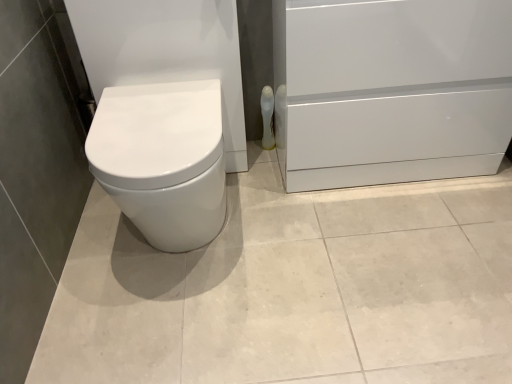
Question: Is white glossy toilet paper at center-right far away from white glossy file cabinet at lower right?

Choices:
 (A) yes
 (B) no

Answer: (B)

Question: Does white glossy toilet paper at center-right appear on the right side of white glossy file cabinet at lower right?

Choices:
 (A) yes
 (B) no

Answer: (B)

Question: From the image's perspective, is white glossy toilet paper at center-right on white glossy file cabinet at lower right?

Choices:
 (A) no
 (B) yes

Answer: (A)

Question: From a real-world perspective, is white glossy toilet paper at center-right located higher than white glossy file cabinet at lower right?

Choices:
 (A) yes
 (B) no

Answer: (B)

Question: Is white glossy toilet paper at center-right smaller than white glossy file cabinet at lower right?

Choices:
 (A) no
 (B) yes

Answer: (B)

Question: Is white glossy toilet paper at center-right thinner than white glossy file cabinet at lower right?

Choices:
 (A) no
 (B) yes

Answer: (B)

Question: Can you confirm if white glossy file cabinet at lower right is smaller than white glossy toilet paper at center-right?

Choices:
 (A) yes
 (B) no

Answer: (B)

Question: Is white glossy toilet paper at center-right at the back of white glossy file cabinet at lower right?

Choices:
 (A) no
 (B) yes

Answer: (A)

Question: Can you confirm if white glossy file cabinet at lower right is positioned to the right of white glossy toilet paper at center-right?

Choices:
 (A) yes
 (B) no

Answer: (A)

Question: Is white glossy file cabinet at lower right oriented towards white glossy toilet paper at center-right?

Choices:
 (A) no
 (B) yes

Answer: (A)

Question: Considering the relative sizes of white glossy file cabinet at lower right and white glossy toilet paper at center-right in the image provided, is white glossy file cabinet at lower right taller than white glossy toilet paper at center-right?

Choices:
 (A) no
 (B) yes

Answer: (B)

Question: From a real-world perspective, is white glossy file cabinet at lower right physically below white glossy toilet paper at center-right?

Choices:
 (A) no
 (B) yes

Answer: (A)

Question: From the image's perspective, is white glossy toilet paper at center-right above or below white glossy file cabinet at lower right?

Choices:
 (A) below
 (B) above

Answer: (A)